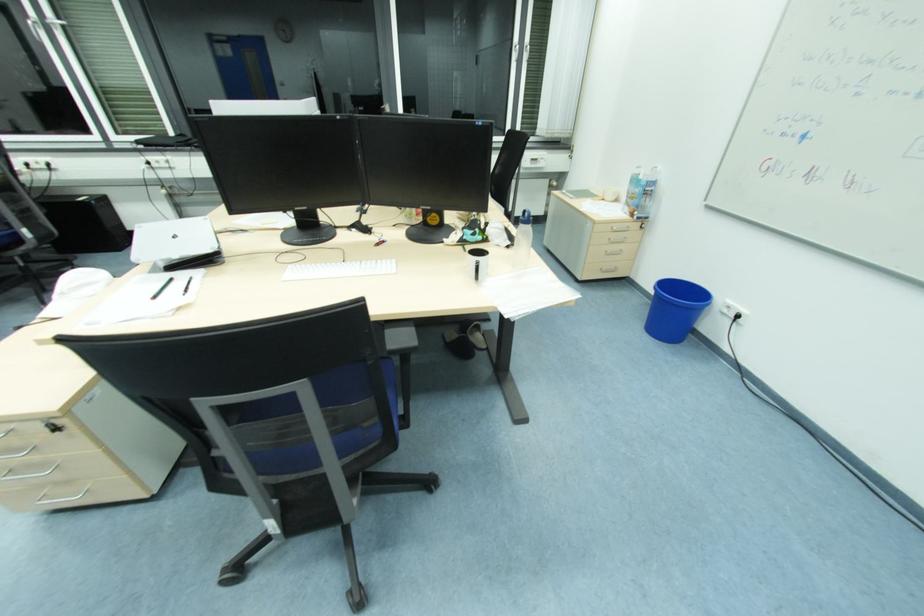
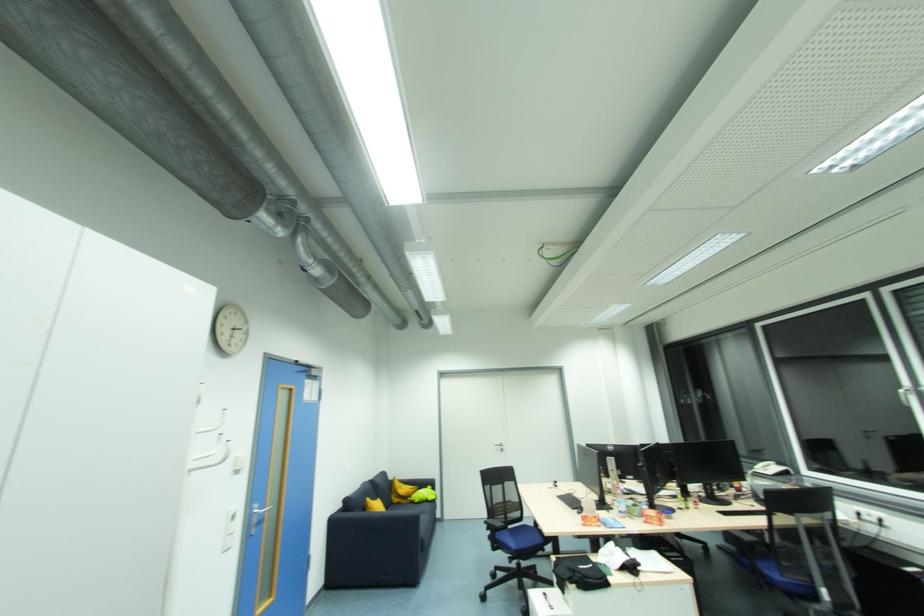
Question: How did the camera likely rotate?

Choices:
 (A) Left
 (B) Right
 (C) Up
 (D) Down

Answer: (A)